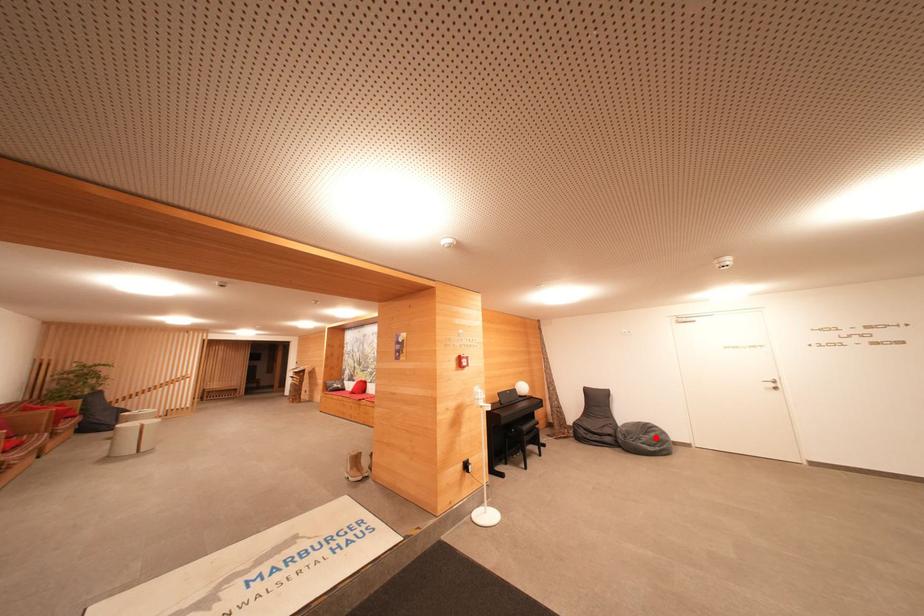
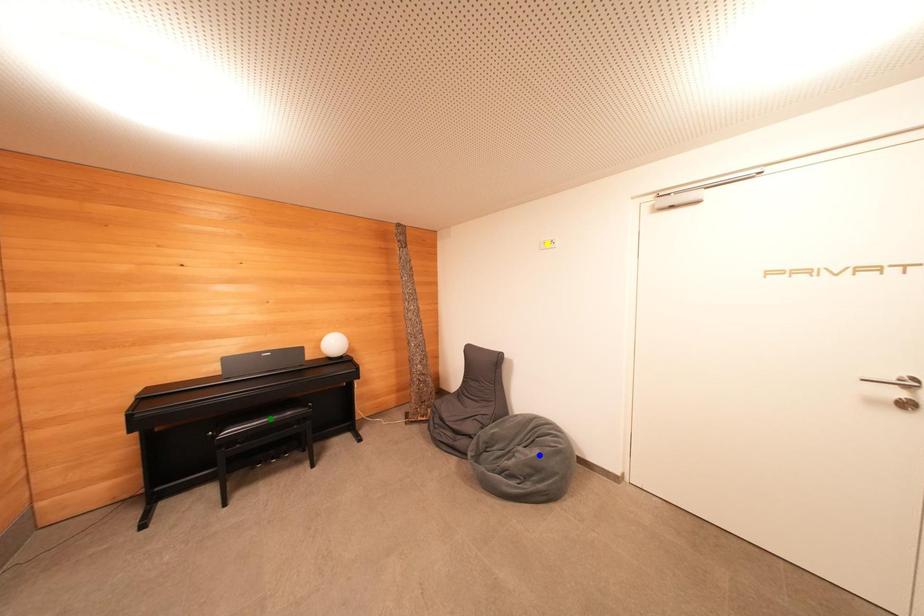
Question: I am providing you with two images of the same scene from different viewpoints. A red point is marked on the first image. You are given multiple points on the second image. Which point in image 2 represents the same 3d spot as the red point in image 1?

Choices:
 (A) yellow point
 (B) green point
 (C) blue point

Answer: (C)